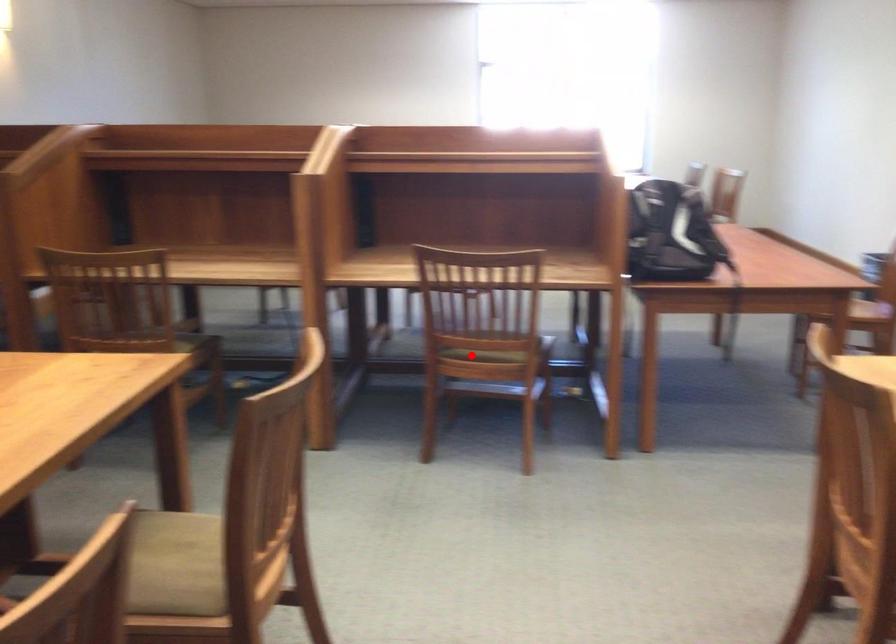
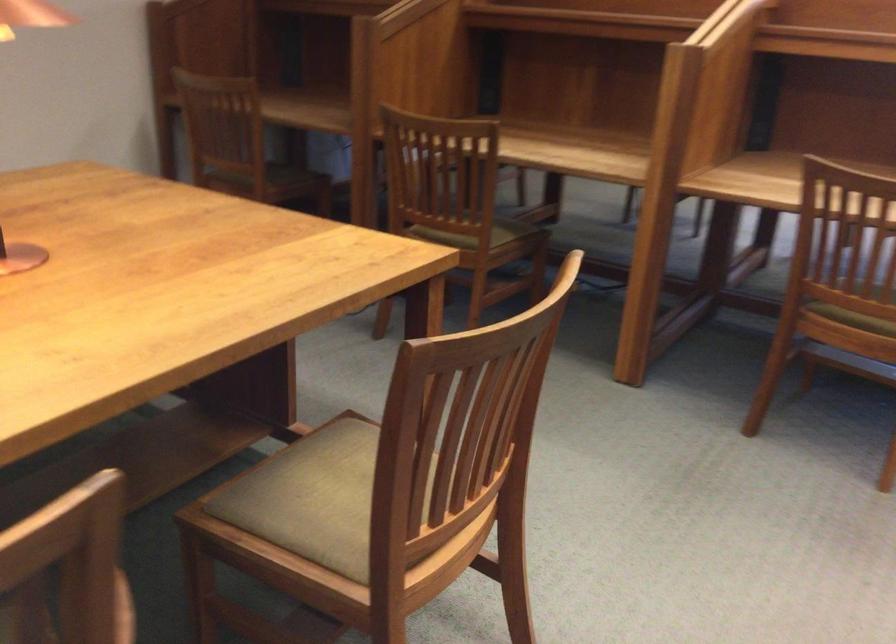
Question: I am providing you with two images of the same scene from different viewpoints. A red point is shown in image1. For the corresponding object point in image2, is it positioned nearer or farther from the camera?

Choices:
 (A) Nearer
 (B) Farther

Answer: (A)